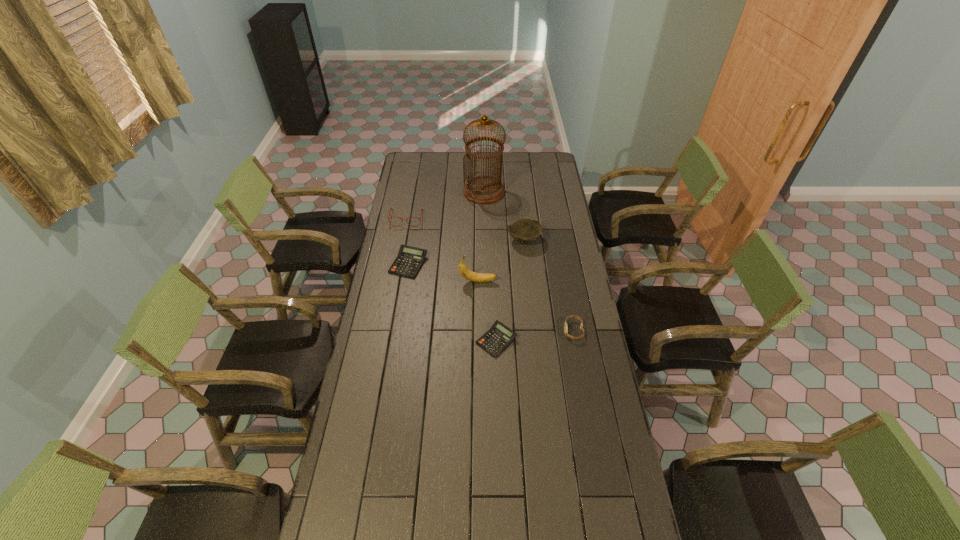
Locate which object is the closest to the birdcage. Please provide its 2D coordinates. Your answer should be formatted as a tuple, i.e. [(x, y)], where the tuple contains the x and y coordinates of a point satisfying the conditions above.

[(525, 230)]

Where is `object that is the third nearest to the fifth shortest object`? The image size is (960, 540). object that is the third nearest to the fifth shortest object is located at coordinates (409, 260).

The height and width of the screenshot is (540, 960). Identify the location of vacant space that satisfies the following two spatial constraints: 1. on the face of the bowl; 2. on the left side of the sixth nearest object. (402, 240).

Locate an element on the screen. This screenshot has height=540, width=960. vacant space that satisfies the following two spatial constraints: 1. on the front side of the second shortest object; 2. on the left side of the shortest object is located at coordinates (396, 341).

This screenshot has width=960, height=540. I want to click on free location that satisfies the following two spatial constraints: 1. on the face of the left calculator; 2. on the left side of the fourth shortest object, so click(398, 264).

You are a GUI agent. You are given a task and a screenshot of the screen. Output one action in this format:
    pyautogui.click(x=<x>, y=<y>)
    Task: Click on the free spot that satisfies the following two spatial constraints: 1. on the front-facing side of the tallest object; 2. at the start of the peel on the banana
    
    Given the screenshot: What is the action you would take?
    pyautogui.click(x=485, y=281)

At what (x,y) coordinates should I click in order to perform the action: click on vacant position in the image that satisfies the following two spatial constraints: 1. on the front-facing side of the third tallest object; 2. on the right side of the birdcage. Please return your answer as a coordinate pair (x, y). Looking at the image, I should click on (485, 240).